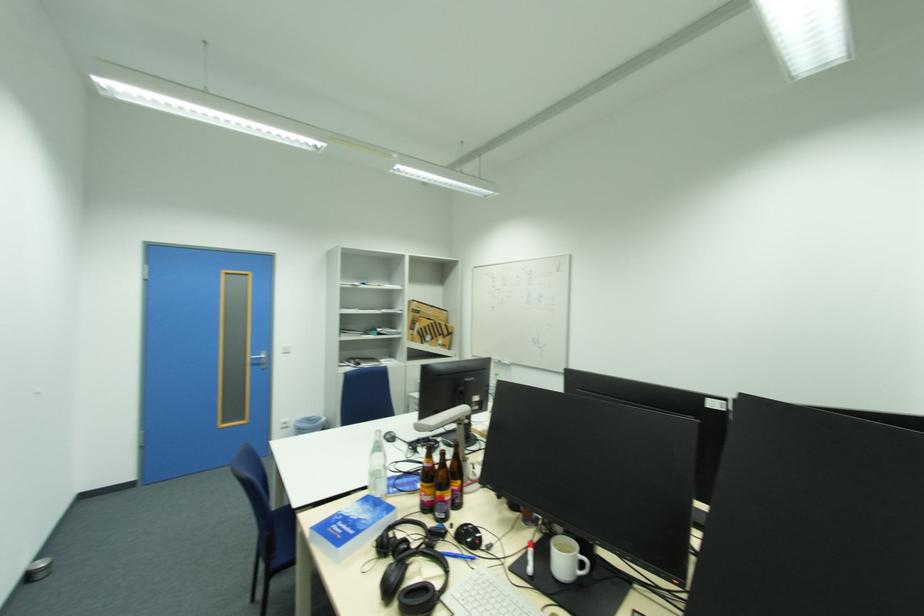
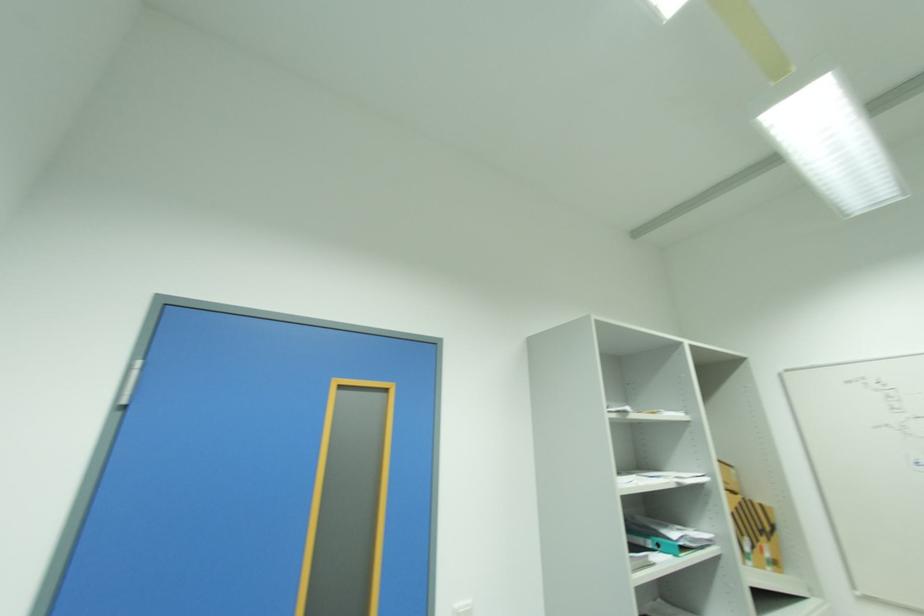
The point at (289, 347) is marked in the first image. Where is the corresponding point in the second image?

(463, 604)